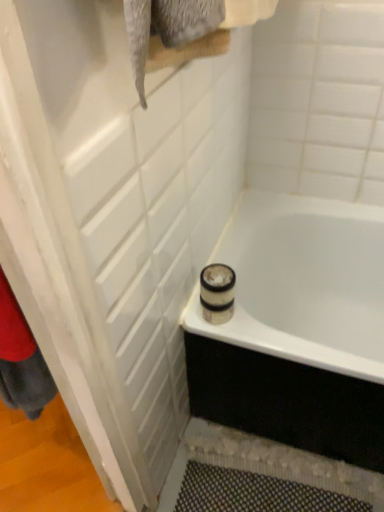
Question: Is white textured screen door at upper left wider or thinner than white glossy bathtub at lower right?

Choices:
 (A) thin
 (B) wide

Answer: (A)

Question: From a real-world perspective, is white textured screen door at upper left above or below white glossy bathtub at lower right?

Choices:
 (A) above
 (B) below

Answer: (A)

Question: Is white textured screen door at upper left taller or shorter than white glossy bathtub at lower right?

Choices:
 (A) short
 (B) tall

Answer: (B)

Question: Is white glossy bathtub at lower right bigger or smaller than white textured screen door at upper left?

Choices:
 (A) small
 (B) big

Answer: (B)

Question: Considering their positions, is white glossy bathtub at lower right located in front of or behind white textured screen door at upper left?

Choices:
 (A) behind
 (B) front

Answer: (A)

Question: Is point (362, 233) closer or farther from the camera than point (79, 311)?

Choices:
 (A) closer
 (B) farther

Answer: (B)

Question: Is white glossy bathtub at lower right taller or shorter than white textured screen door at upper left?

Choices:
 (A) short
 (B) tall

Answer: (A)